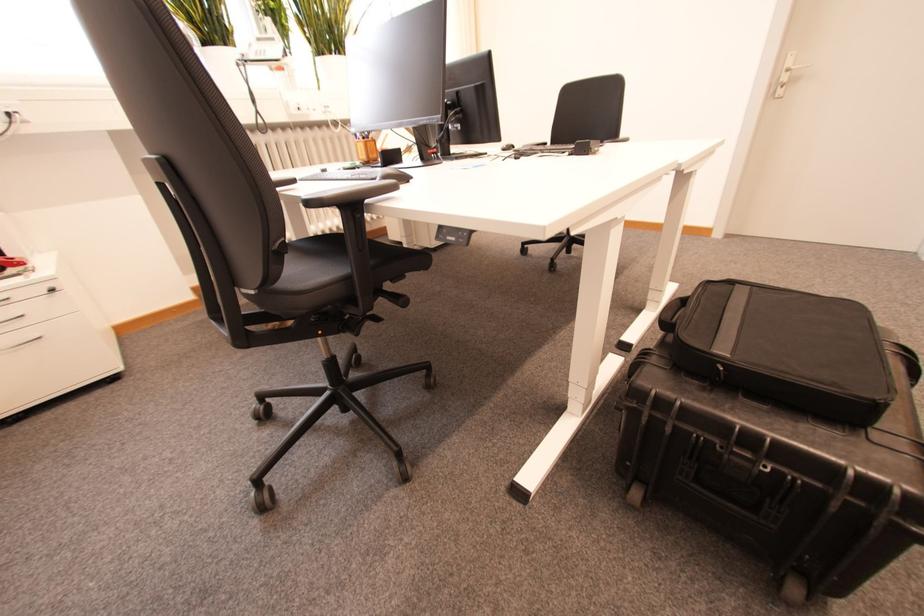
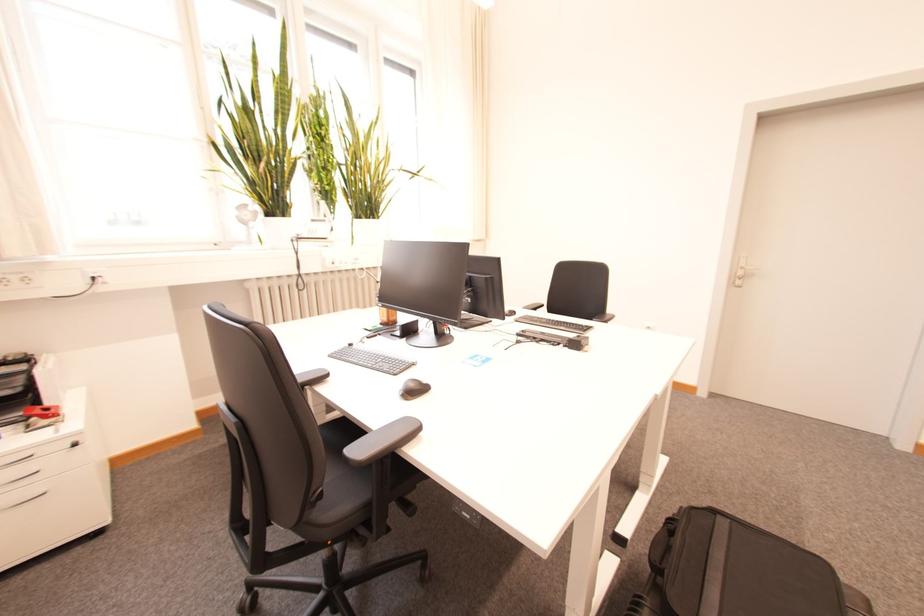
Question: What movement of the cameraman would produce the second image?

Choices:
 (A) Left
 (B) Right
 (C) Forward
 (D) Backward

Answer: (D)